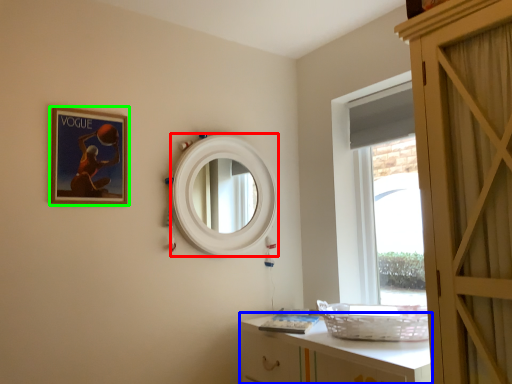
Question: Estimate the real-world distances between objects in this image. Which object is farther from mirror (highlighted by a red box), cabinetry (highlighted by a blue box) or picture frame (highlighted by a green box)?

Choices:
 (A) cabinetry
 (B) picture frame

Answer: (A)